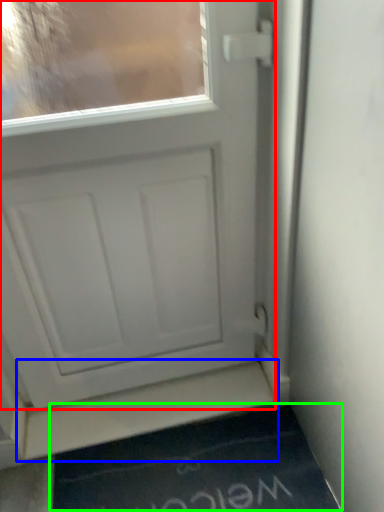
Question: Based on their relative distances, which object is nearer to door (highlighted by a red box)? Choose from stairwell (highlighted by a blue box) and doormat (highlighted by a green box).

Choices:
 (A) stairwell
 (B) doormat

Answer: (A)